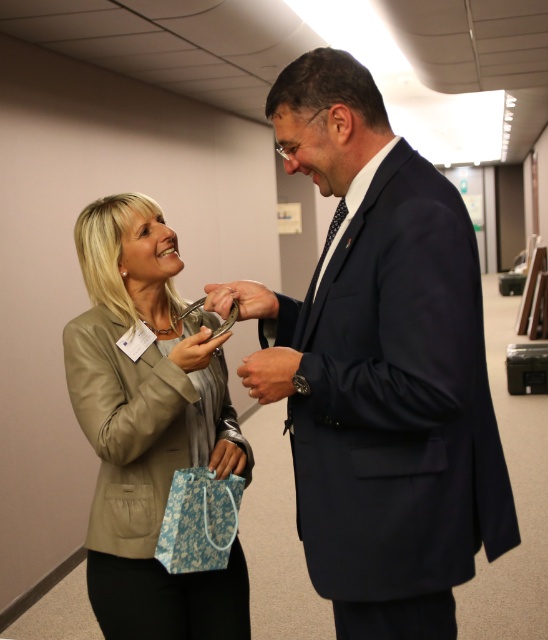
Question: Which object is farther from the camera taking this photo?

Choices:
 (A) navy blue suit at center
 (B) beige leather jacket at left

Answer: (B)

Question: Is navy blue suit at center to the right of beige leather jacket at left from the viewer's perspective?

Choices:
 (A) no
 (B) yes

Answer: (B)

Question: Does navy blue suit at center appear under beige leather jacket at left?

Choices:
 (A) yes
 (B) no

Answer: (B)

Question: Is navy blue suit at center wider than beige leather jacket at left?

Choices:
 (A) yes
 (B) no

Answer: (A)